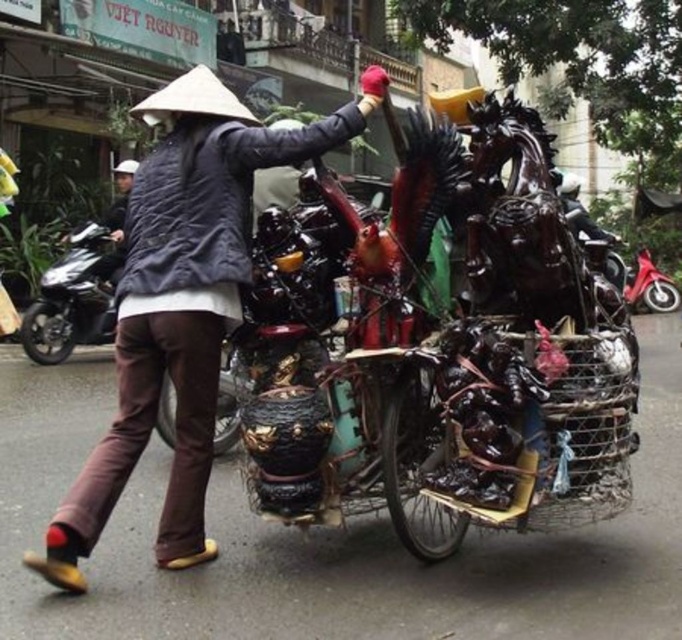
You are a delivery person who needs to park your 10 feet long delivery van between the shiny black motorcycle at left and the metallic red scooter at right. Can you fit your van between them without moving either vehicle?

The distance between the shiny black motorcycle at left and the metallic red scooter at right is 20.29 feet. Since your delivery van is 10 feet long, it can fit between them as the available space is more than twice the van length.

You are a delivery person needing to place a package between the matte black vase at center and the shiny black motorcycle at left. The package requires 3 meters of space. Is there enough space between them?

The distance between the matte black vase at center and the shiny black motorcycle at left is 3.73 meters, which is more than the required 3 meters, so yes, there is enough space to place the package between them.

You are standing at the point marked by the coordinates [181,304] in the image. What object is located exactly at this point?

The point marked by the coordinates [181,304] is located at the matte black vase at center.